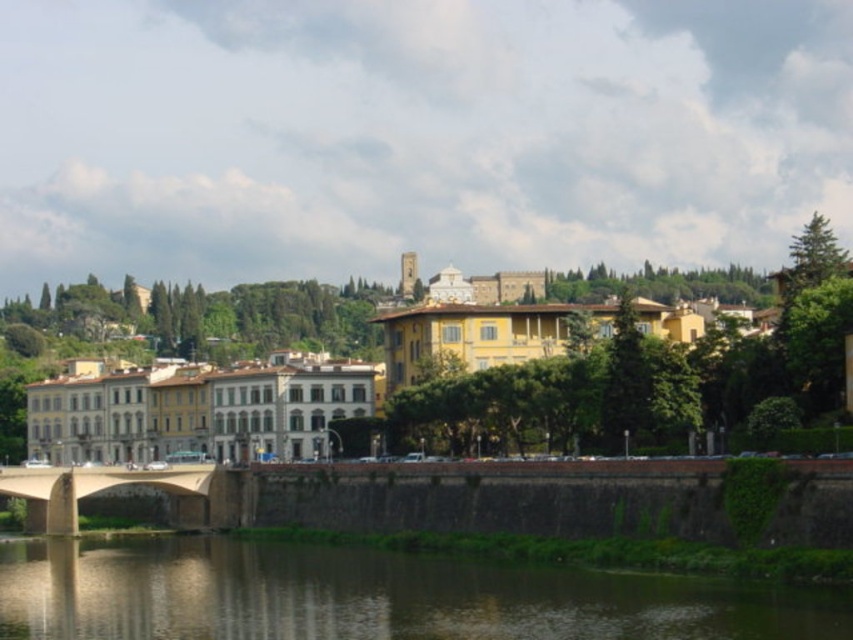
Is point (405, 604) farther from camera compared to point (144, 472)?

No, (405, 604) is in front of (144, 472).

Who is higher up, brown reflective water at lower center or brown stone bridge at lower left?

brown reflective water at lower center

What do you see at coordinates (375, 596) in the screenshot? I see `brown reflective water at lower center` at bounding box center [375, 596].

Locate an element on the screen. This screenshot has width=853, height=640. brown reflective water at lower center is located at coordinates (375, 596).

Does point (228, 388) come behind point (106, 474)?

Yes, point (228, 388) is behind point (106, 474).

Which is in front, point (480, 429) or point (178, 515)?

Point (480, 429)

The image size is (853, 640). I want to click on yellow matte building at center, so click(x=485, y=385).

Does yellow matte building at center appear on the right side of brown reflective water at lower center?

Indeed, yellow matte building at center is positioned on the right side of brown reflective water at lower center.

The height and width of the screenshot is (640, 853). I want to click on yellow matte building at center, so click(x=485, y=385).

Where is `yellow matte building at center`? This screenshot has width=853, height=640. yellow matte building at center is located at coordinates [x=485, y=385].